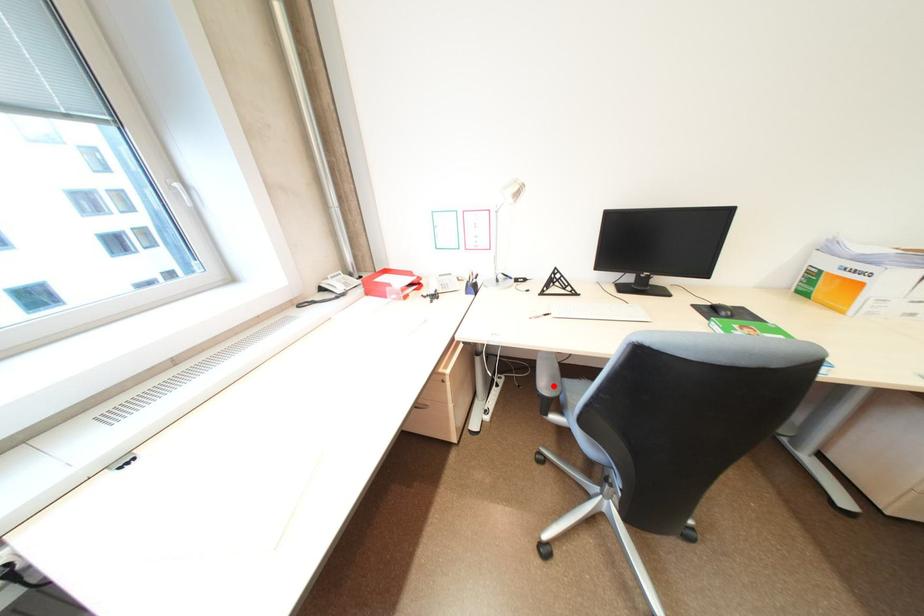
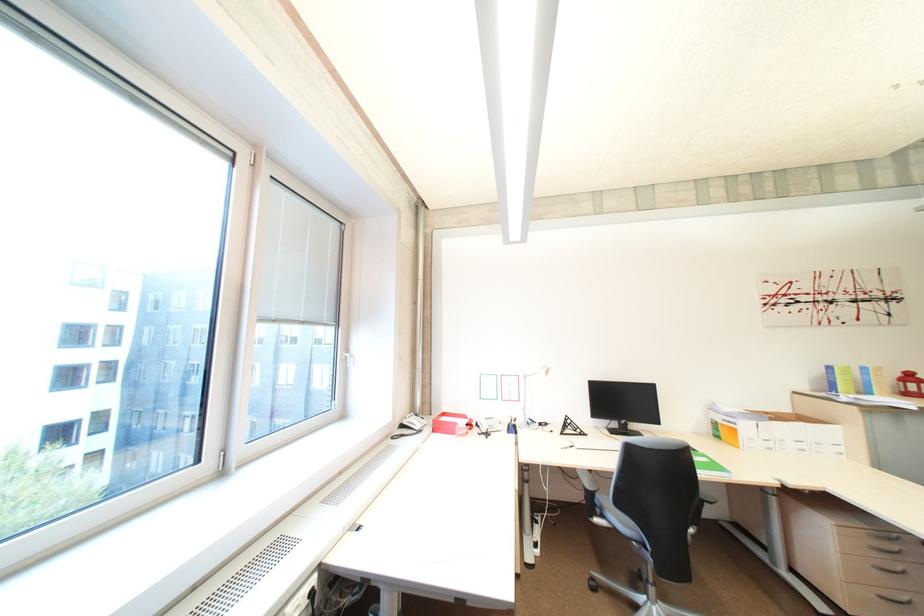
The point at the highlighted location is marked in the first image. Where is the corresponding point in the second image?

(598, 485)